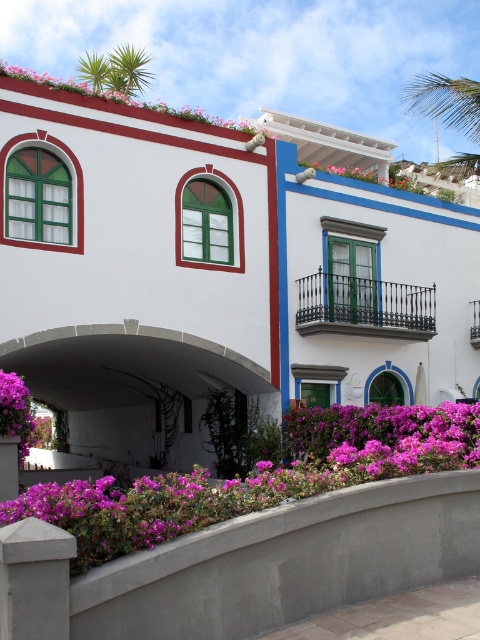
Can you confirm if purple matte flowers at lower left is wider than purple matte flower at lower left?

Yes.

Is point (106, 477) closer to camera compared to point (17, 449)?

Yes, point (106, 477) is closer to viewer.

Identify the location of purple matte flowers at lower left. The height and width of the screenshot is (640, 480). (254, 477).

Who is lower down, purple matte flowers at lower left or pink matte flowers at upper left?

purple matte flowers at lower left is below.

Can you confirm if purple matte flowers at lower left is shorter than pink matte flowers at upper left?

Correct, purple matte flowers at lower left is not as tall as pink matte flowers at upper left.

Which is in front, point (134, 538) or point (69, 86)?

Point (134, 538) is in front.

In order to click on purple matte flowers at lower left in this screenshot , I will do `click(254, 477)`.

Which is below, purple matte flowers at center or purple matte flower at lower left?

purple matte flowers at center is lower down.

Describe the element at coordinates (381, 428) in the screenshot. The image size is (480, 640). I see `purple matte flowers at center` at that location.

At what (x,y) coordinates should I click in order to perform the action: click on purple matte flowers at center. Please return your answer as a coordinate pair (x, y). Image resolution: width=480 pixels, height=640 pixels. Looking at the image, I should click on (381, 428).